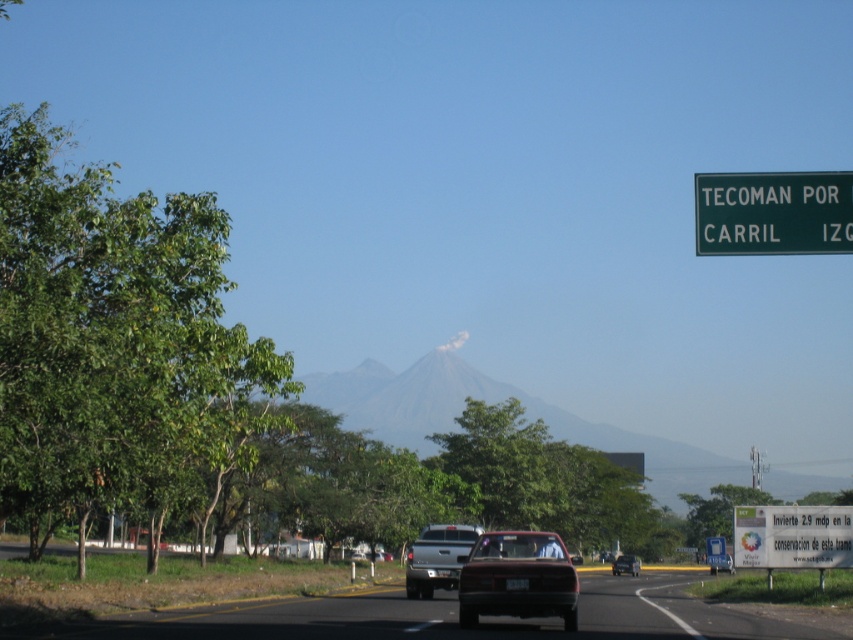
You are standing at the point with coordinates (x=448, y=618) in the image. What is the object you are standing on?

The point at coordinates (x=448, y=618) corresponds to the black asphalt road at center, so you are standing on the black asphalt road at center.